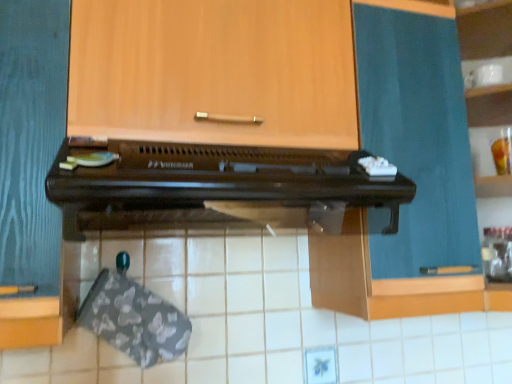
Find the location of a particular element. This screenshot has height=384, width=512. teal fabric curtain at upper right, placed as the 1th cabinetry when sorted from right to left is located at coordinates (420, 166).

In order to face brown wooden oven at center, should I rotate leftwards or rightwards?

You should rotate left by 4.827 degrees.

Image resolution: width=512 pixels, height=384 pixels. What do you see at coordinates (487, 73) in the screenshot?
I see `white glossy cup at upper right` at bounding box center [487, 73].

Locate an element on the screen. The image size is (512, 384). teal fabric curtain at upper right, the 2th cabinetry positioned from the left is located at coordinates (420, 166).

From the picture: Considering their positions, is teal fabric curtain at upper right, the 2th cabinetry positioned from the left, located in front of or behind brown wooden oven at center?

Clearly, teal fabric curtain at upper right, the 2th cabinetry positioned from the left, is behind brown wooden oven at center.

Is point (410, 269) closer to viewer compared to point (365, 177)?

No.

From a real-world perspective, is teal fabric curtain at upper right, placed as the 1th cabinetry when sorted from right to left, over brown wooden oven at center?

Correct, in the physical world, teal fabric curtain at upper right, placed as the 1th cabinetry when sorted from right to left, is higher than brown wooden oven at center.

Where is `the 1st cabinetry positioned above the brown wooden oven at center (from a real-world perspective)`? the 1st cabinetry positioned above the brown wooden oven at center (from a real-world perspective) is located at coordinates (420, 166).

Is wooden cabinet at upper center, which is the first cabinetry from left to right, oriented away from white glossy cup at upper right?

No, white glossy cup at upper right is not at the back of wooden cabinet at upper center, which is the first cabinetry from left to right.

Starting from the white glossy cup at upper right, which cabinetry is the 2nd one to the left? Please provide its 2D coordinates.

[(214, 71)]

Can you confirm if wooden cabinet at upper center, which is the first cabinetry from left to right, is smaller than white glossy cup at upper right?

No, wooden cabinet at upper center, which is the first cabinetry from left to right, is not smaller than white glossy cup at upper right.

Is wooden cabinet at upper center, which is the first cabinetry from left to right, completely or partially outside of white glossy cup at upper right?

Absolutely, wooden cabinet at upper center, which is the first cabinetry from left to right, is external to white glossy cup at upper right.

Is brown wooden oven at center positioned with its back to wooden cabinet at upper center, the 2th cabinetry positioned from the right?

brown wooden oven at center is not turned away from wooden cabinet at upper center, the 2th cabinetry positioned from the right.

Which is more to the right, brown wooden oven at center or wooden cabinet at upper center, which is the first cabinetry from left to right?

brown wooden oven at center.

Is brown wooden oven at center wider than wooden cabinet at upper center, which is the first cabinetry from left to right?

Yes, brown wooden oven at center is wider than wooden cabinet at upper center, which is the first cabinetry from left to right.

Can you tell me how much brown wooden oven at center and wooden cabinet at upper center, the 2th cabinetry positioned from the right, differ in facing direction?

brown wooden oven at center and wooden cabinet at upper center, the 2th cabinetry positioned from the right, are facing 1.22 degrees away from each other.

Is brown wooden oven at center positioned before white glossy cup at upper right?

That is True.

Is brown wooden oven at center oriented away from white glossy cup at upper right?

No, white glossy cup at upper right is not at the back of brown wooden oven at center.

Is brown wooden oven at center not near white glossy cup at upper right?

They are positioned close to each other.

Which of these two, brown wooden oven at center or white glossy cup at upper right, is thinner?

Thinner between the two is white glossy cup at upper right.

From the picture: Can you confirm if white glossy cup at upper right is smaller than brown wooden oven at center?

Indeed, white glossy cup at upper right has a smaller size compared to brown wooden oven at center.

Which is more to the left, white glossy cup at upper right or brown wooden oven at center?

brown wooden oven at center.

How distant is white glossy cup at upper right from brown wooden oven at center?

They are 30.70 inches apart.

From a real-world perspective, who is located higher, white glossy cup at upper right or brown wooden oven at center?

white glossy cup at upper right is physically above.

Is wooden cabinet at upper center, which is the first cabinetry from left to right, to the right of brown wooden oven at center from the viewer's perspective?

No, wooden cabinet at upper center, which is the first cabinetry from left to right, is not to the right of brown wooden oven at center.

Looking at this image, is the surface of wooden cabinet at upper center, the 2th cabinetry positioned from the right, in direct contact with brown wooden oven at center?

No, wooden cabinet at upper center, the 2th cabinetry positioned from the right, is not in contact with brown wooden oven at center.

In the scene shown: Can we say wooden cabinet at upper center, which is the first cabinetry from left to right, lies outside brown wooden oven at center?

Yes, wooden cabinet at upper center, which is the first cabinetry from left to right, is not within brown wooden oven at center.

Considering the relative sizes of wooden cabinet at upper center, which is the first cabinetry from left to right, and brown wooden oven at center in the image provided, is wooden cabinet at upper center, which is the first cabinetry from left to right, taller than brown wooden oven at center?

Correct, wooden cabinet at upper center, which is the first cabinetry from left to right, is much taller as brown wooden oven at center.

How many degrees apart are the facing directions of white glossy cup at upper right and teal fabric curtain at upper right, the 2th cabinetry positioned from the left?

44 degrees.

From the image's perspective, is white glossy cup at upper right on top of teal fabric curtain at upper right, placed as the 1th cabinetry when sorted from right to left?

Yes, from the image's perspective, white glossy cup at upper right is over teal fabric curtain at upper right, placed as the 1th cabinetry when sorted from right to left.

Is the position of white glossy cup at upper right less distant than that of teal fabric curtain at upper right, the 2th cabinetry positioned from the left?

No, it is not.

Does white glossy cup at upper right turn towards teal fabric curtain at upper right, placed as the 1th cabinetry when sorted from right to left?

No.

The height and width of the screenshot is (384, 512). I want to click on oven that appears in front of the teal fabric curtain at upper right, the 2th cabinetry positioned from the left, so click(x=215, y=187).

Image resolution: width=512 pixels, height=384 pixels. Find the location of `shelf behind the wooden cabinet at upper center, which is the first cabinetry from left to right`. shelf behind the wooden cabinet at upper center, which is the first cabinetry from left to right is located at coordinates (487, 73).

Based on their spatial positions, is teal fabric curtain at upper right, the 2th cabinetry positioned from the left, or wooden cabinet at upper center, the 2th cabinetry positioned from the right, further from brown wooden oven at center?

Among the two, teal fabric curtain at upper right, the 2th cabinetry positioned from the left, is located further to brown wooden oven at center.

When comparing their distances from wooden cabinet at upper center, which is the first cabinetry from left to right, does teal fabric curtain at upper right, placed as the 1th cabinetry when sorted from right to left, or brown wooden oven at center seem further?

teal fabric curtain at upper right, placed as the 1th cabinetry when sorted from right to left, is further to wooden cabinet at upper center, which is the first cabinetry from left to right.

Which object lies further to the anchor point brown wooden oven at center, white glossy cup at upper right or wooden cabinet at upper center, the 2th cabinetry positioned from the right?

The object further to brown wooden oven at center is white glossy cup at upper right.

Which object lies nearer to the anchor point teal fabric curtain at upper right, the 2th cabinetry positioned from the left, white glossy cup at upper right or brown wooden oven at center?

brown wooden oven at center lies closer to teal fabric curtain at upper right, the 2th cabinetry positioned from the left, than the other object.

Estimate the real-world distances between objects in this image. Which object is closer to teal fabric curtain at upper right, the 2th cabinetry positioned from the left, white glossy cup at upper right or wooden cabinet at upper center, the 2th cabinetry positioned from the right?

wooden cabinet at upper center, the 2th cabinetry positioned from the right, is closer to teal fabric curtain at upper right, the 2th cabinetry positioned from the left.

Estimate the real-world distances between objects in this image. Which object is closer to brown wooden oven at center, teal fabric curtain at upper right, the 2th cabinetry positioned from the left, or white glossy cup at upper right?

teal fabric curtain at upper right, the 2th cabinetry positioned from the left, lies closer to brown wooden oven at center than the other object.

When comparing their distances from wooden cabinet at upper center, the 2th cabinetry positioned from the right, does brown wooden oven at center or white glossy cup at upper right seem closer?

The object closer to wooden cabinet at upper center, the 2th cabinetry positioned from the right, is brown wooden oven at center.

Looking at the image, which one is located further to teal fabric curtain at upper right, the 2th cabinetry positioned from the left, brown wooden oven at center or wooden cabinet at upper center, which is the first cabinetry from left to right?

Among the two, wooden cabinet at upper center, which is the first cabinetry from left to right, is located further to teal fabric curtain at upper right, the 2th cabinetry positioned from the left.

Identify the location of cabinetry between brown wooden oven at center and white glossy cup at upper right from left to right. The height and width of the screenshot is (384, 512). (420, 166).

The width and height of the screenshot is (512, 384). I want to click on oven between wooden cabinet at upper center, the 2th cabinetry positioned from the right, and teal fabric curtain at upper right, placed as the 1th cabinetry when sorted from right to left, from left to right, so click(215, 187).

You are a GUI agent. You are given a task and a screenshot of the screen. Output one action in this format:
    pyautogui.click(x=<x>, y=<y>)
    Task: Click on the oven between wooden cabinet at upper center, the 2th cabinetry positioned from the right, and white glossy cup at upper right from left to right
    The height and width of the screenshot is (384, 512).
    Given the screenshot: What is the action you would take?
    pyautogui.click(x=215, y=187)

You are a GUI agent. You are given a task and a screenshot of the screen. Output one action in this format:
    pyautogui.click(x=<x>, y=<y>)
    Task: Click on the cabinetry between wooden cabinet at upper center, which is the first cabinetry from left to right, and white glossy cup at upper right, in the horizontal direction
    Image resolution: width=512 pixels, height=384 pixels.
    Given the screenshot: What is the action you would take?
    pyautogui.click(x=420, y=166)